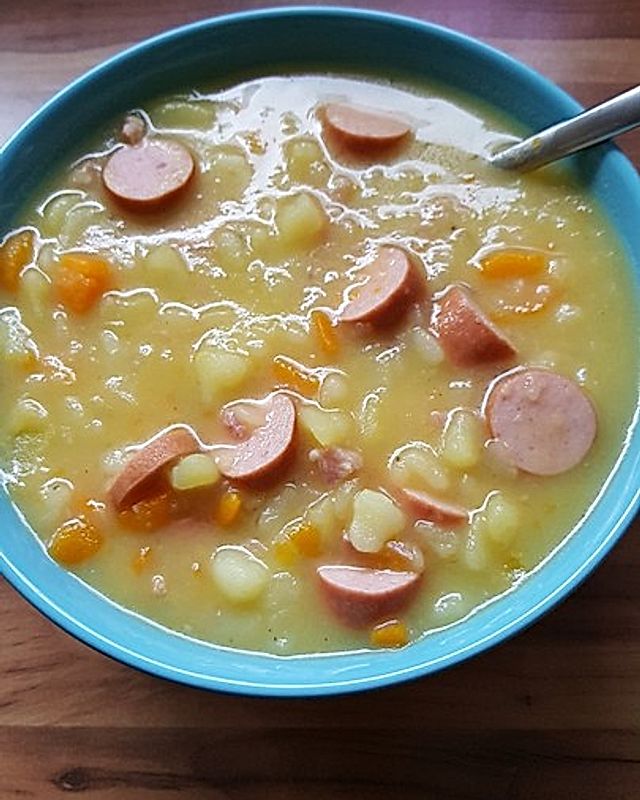
Find the location of a particular element. The height and width of the screenshot is (800, 640). woodgrain table top is located at coordinates (561, 42).